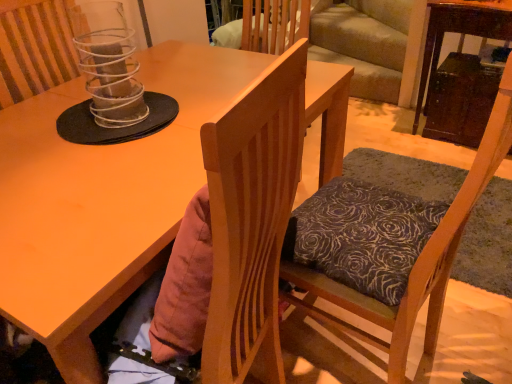
Question: Can you confirm if matte wood desk at center is positioned to the left of wooden chair with patterned cushion at center?

Choices:
 (A) no
 (B) yes

Answer: (B)

Question: From the image's perspective, is matte wood desk at center located beneath wooden chair with patterned cushion at center?

Choices:
 (A) no
 (B) yes

Answer: (B)

Question: From a real-world perspective, is matte wood desk at center beneath wooden chair with patterned cushion at center?

Choices:
 (A) yes
 (B) no

Answer: (A)

Question: From the image's perspective, is matte wood desk at center above wooden chair with patterned cushion at center?

Choices:
 (A) no
 (B) yes

Answer: (A)

Question: Is matte wood desk at center outside wooden chair with patterned cushion at center?

Choices:
 (A) no
 (B) yes

Answer: (B)

Question: Considering the positions of clear plastic spiral at upper center and wooden chair with patterned cushion at center in the image, is clear plastic spiral at upper center bigger or smaller than wooden chair with patterned cushion at center?

Choices:
 (A) small
 (B) big

Answer: (A)

Question: Considering the positions of clear plastic spiral at upper center and wooden chair with patterned cushion at center in the image, is clear plastic spiral at upper center taller or shorter than wooden chair with patterned cushion at center?

Choices:
 (A) tall
 (B) short

Answer: (B)

Question: From a real-world perspective, is clear plastic spiral at upper center physically located above or below wooden chair with patterned cushion at center?

Choices:
 (A) above
 (B) below

Answer: (A)

Question: Is clear plastic spiral at upper center inside or outside of wooden chair with patterned cushion at center?

Choices:
 (A) outside
 (B) inside

Answer: (A)

Question: Is point (96, 97) closer or farther from the camera than point (109, 279)?

Choices:
 (A) closer
 (B) farther

Answer: (B)

Question: Is clear plastic spiral at upper center in front of or behind matte wood desk at center in the image?

Choices:
 (A) front
 (B) behind

Answer: (B)

Question: Looking at their shapes, would you say clear plastic spiral at upper center is wider or thinner than matte wood desk at center?

Choices:
 (A) thin
 (B) wide

Answer: (A)

Question: In terms of size, does clear plastic spiral at upper center appear bigger or smaller than matte wood desk at center?

Choices:
 (A) big
 (B) small

Answer: (B)

Question: Considering the positions of wooden chair with patterned cushion at center and matte wood desk at center in the image, is wooden chair with patterned cushion at center wider or thinner than matte wood desk at center?

Choices:
 (A) thin
 (B) wide

Answer: (A)

Question: Choose the correct answer: Is wooden chair with patterned cushion at center inside matte wood desk at center or outside it?

Choices:
 (A) outside
 (B) inside

Answer: (A)